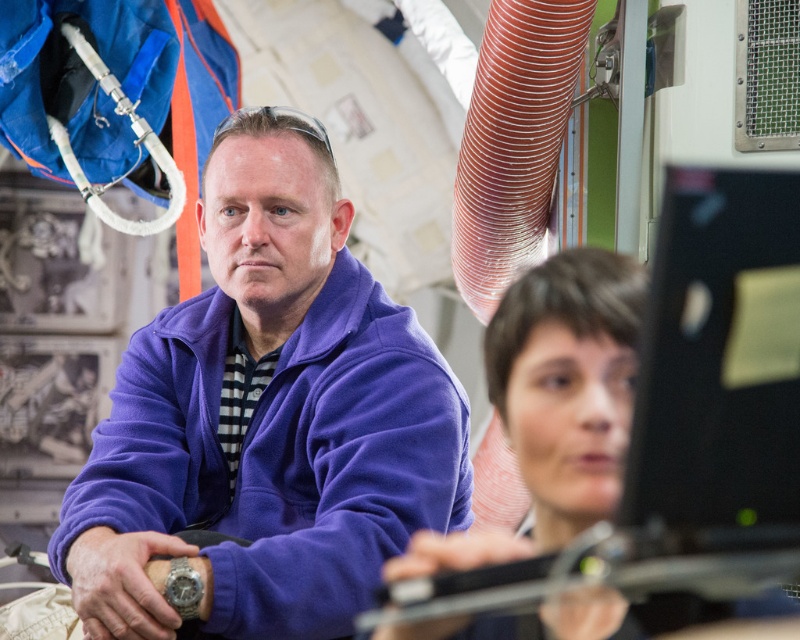
You are an observer in the scene. You notice the purple fleece jacket at center and the smooth brown hair at center. Which object is taller?

The purple fleece jacket at center is taller than smooth brown hair at center.

You are standing in the laboratory scene described. There is a point at coordinates (268, 419). What object is located at that point?

The point at coordinates (268, 419) corresponds to the purple fleece jacket at center.

You are designing a new coat rack for the lab. The purple fleece jacket at center and the smooth brown hair at center need to be hung side by side. Which object requires a wider hook to accommodate its width?

The purple fleece jacket at center requires a wider hook because its width is larger than the smooth brown hair at center.